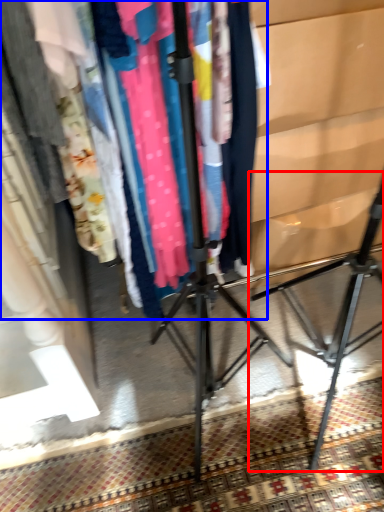
Question: Among these objects, which one is farthest to the camera, tripod (highlighted by a red box) or closet (highlighted by a blue box)?

Choices:
 (A) tripod
 (B) closet

Answer: (B)